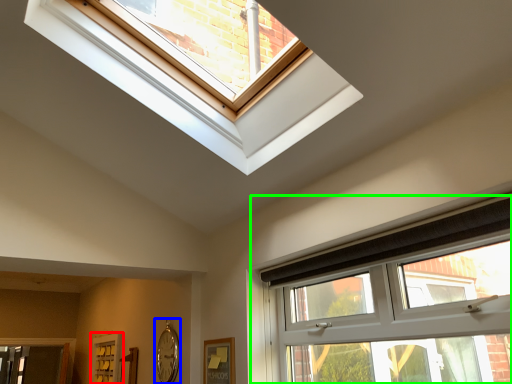
Question: Which object is the closest to the screen door (highlighted by a red box)? Choose among these: clock (highlighted by a blue box) or window (highlighted by a green box).

Choices:
 (A) clock
 (B) window

Answer: (A)